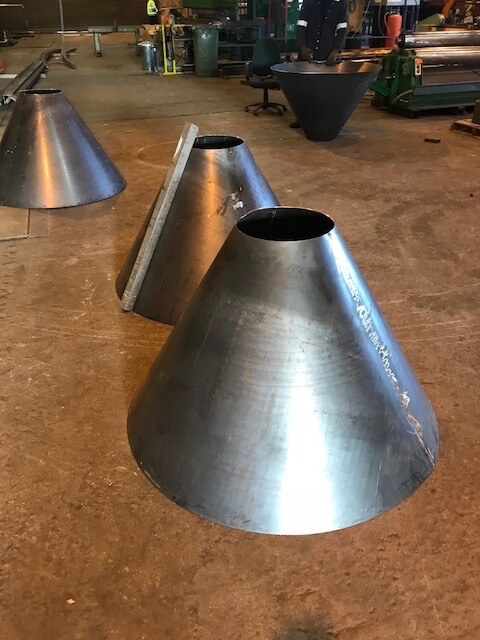
Locate an element on the screen. Image resolution: width=480 pixels, height=640 pixels. floor is located at coordinates (80, 386), (448, 308), (112, 88).